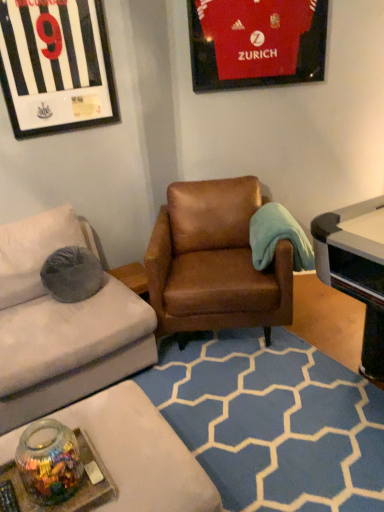
What do you see at coordinates (8, 497) in the screenshot? I see `black plastic remote control at lower left` at bounding box center [8, 497].

This screenshot has height=512, width=384. Describe the element at coordinates (67, 499) in the screenshot. I see `transparent glass jar at lower left` at that location.

Image resolution: width=384 pixels, height=512 pixels. I want to click on matte red jersey at upper right, the second picture frame from the left, so click(x=256, y=42).

What is the approximate height of brown leather armchair at center?

It is 85.01 centimeters.

The height and width of the screenshot is (512, 384). Identify the location of black glossy jersey at upper left, which is the second picture frame in right-to-left order. [56, 66].

Find the location of a particular element. This screenshot has width=384, height=512. black plastic remote control at lower left is located at coordinates (8, 497).

Is matte red jersey at upper right, arranged as the 1th picture frame when viewed from the right, looking in the opposite direction of brown leather armchair at center?

No, matte red jersey at upper right, arranged as the 1th picture frame when viewed from the right, is not facing the opposite direction of brown leather armchair at center.

How many degrees apart are the facing directions of matte red jersey at upper right, arranged as the 1th picture frame when viewed from the right, and brown leather armchair at center?

The facing directions of matte red jersey at upper right, arranged as the 1th picture frame when viewed from the right, and brown leather armchair at center are 0.000905 degrees apart.

Consider the image. Is the surface of matte red jersey at upper right, arranged as the 1th picture frame when viewed from the right, in direct contact with brown leather armchair at center?

matte red jersey at upper right, arranged as the 1th picture frame when viewed from the right, and brown leather armchair at center are clearly separated.

Which is more to the left, matte red jersey at upper right, the second picture frame from the left, or brown leather armchair at center?

From the viewer's perspective, brown leather armchair at center appears more on the left side.

How different are the orientations of black plastic remote control at lower left and matte red jersey at upper right, the second picture frame from the left, in degrees?

32.7 degrees separate the facing orientations of black plastic remote control at lower left and matte red jersey at upper right, the second picture frame from the left.

Looking at the image, does black plastic remote control at lower left seem bigger or smaller compared to matte red jersey at upper right, the second picture frame from the left?

In the image, black plastic remote control at lower left appears to be smaller than matte red jersey at upper right, the second picture frame from the left.

In the image, there is a matte red jersey at upper right, the second picture frame from the left. Identify the location of remote control below it (from the image's perspective). (8, 497).

Is black plastic remote control at lower left outside of matte red jersey at upper right, the second picture frame from the left?

Yes, black plastic remote control at lower left is not within matte red jersey at upper right, the second picture frame from the left.

Considering the sizes of objects black plastic remote control at lower left and transparent glass jar at lower left in the image provided, who is taller, black plastic remote control at lower left or transparent glass jar at lower left?

transparent glass jar at lower left.

This screenshot has height=512, width=384. Find the location of `round table that is on the right side of black plastic remote control at lower left`. round table that is on the right side of black plastic remote control at lower left is located at coordinates (67, 499).

Consider the image. From a real-world perspective, does black plastic remote control at lower left sit lower than transparent glass jar at lower left?

Yes, from a real-world perspective, black plastic remote control at lower left is beneath transparent glass jar at lower left.

From the picture: From a real-world perspective, which is physically below, black glossy jersey at upper left, which is the second picture frame in right-to-left order, or black plastic remote control at lower left?

black plastic remote control at lower left, from a real-world perspective.

Consider the image. Is the depth of black glossy jersey at upper left, which is the second picture frame in right-to-left order, less than that of black plastic remote control at lower left?

No, the depth of black glossy jersey at upper left, which is the second picture frame in right-to-left order, is greater than that of black plastic remote control at lower left.

Looking at this image, can you confirm if black glossy jersey at upper left, which is the second picture frame in right-to-left order, is thinner than black plastic remote control at lower left?

Yes, black glossy jersey at upper left, which is the second picture frame in right-to-left order, is thinner than black plastic remote control at lower left.

Does black glossy jersey at upper left, which is the second picture frame in right-to-left order, have a lesser height compared to black plastic remote control at lower left?

In fact, black glossy jersey at upper left, which is the second picture frame in right-to-left order, may be taller than black plastic remote control at lower left.

How distant is matte red jersey at upper right, arranged as the 1th picture frame when viewed from the right, from transparent glass jar at lower left?

matte red jersey at upper right, arranged as the 1th picture frame when viewed from the right, and transparent glass jar at lower left are 2.32 meters apart from each other.

In the scene shown: Is matte red jersey at upper right, arranged as the 1th picture frame when viewed from the right, turned away from transparent glass jar at lower left?

No, matte red jersey at upper right, arranged as the 1th picture frame when viewed from the right, is not facing the opposite direction of transparent glass jar at lower left.

Based on the photo, from the image's perspective, who appears lower, matte red jersey at upper right, the second picture frame from the left, or transparent glass jar at lower left?

transparent glass jar at lower left.

From a real-world perspective, is brown leather armchair at center above or below black plastic remote control at lower left?

brown leather armchair at center is situated higher than black plastic remote control at lower left in the real world.

Is brown leather armchair at center oriented away from black plastic remote control at lower left?

brown leather armchair at center does not have its back to black plastic remote control at lower left.

Is brown leather armchair at center not within black plastic remote control at lower left?

Absolutely, brown leather armchair at center is external to black plastic remote control at lower left.

From the image's perspective, is brown leather armchair at center located above black plastic remote control at lower left?

Yes, from the image's perspective, brown leather armchair at center is over black plastic remote control at lower left.

Is matte red jersey at upper right, arranged as the 1th picture frame when viewed from the right, positioned in front of black plastic remote control at lower left?

No, the depth of matte red jersey at upper right, arranged as the 1th picture frame when viewed from the right, is greater than that of black plastic remote control at lower left.

Is point (211, 58) in front of point (10, 502)?

No, (211, 58) is behind (10, 502).

Consider the image. From a real-world perspective, which object rests below the other?

In real-world perspective, black plastic remote control at lower left is lower.

Is matte red jersey at upper right, the second picture frame from the left, placed right next to black plastic remote control at lower left?

No, matte red jersey at upper right, the second picture frame from the left, is not in contact with black plastic remote control at lower left.

Identify the location of chair below the matte red jersey at upper right, arranged as the 1th picture frame when viewed from the right (from the image's perspective). (214, 262).

The image size is (384, 512). I want to click on remote control located underneath the matte red jersey at upper right, arranged as the 1th picture frame when viewed from the right (from a real-world perspective), so click(x=8, y=497).

Based on their spatial positions, is matte red jersey at upper right, the second picture frame from the left, or transparent glass jar at lower left closer to black plastic remote control at lower left?

Based on the image, transparent glass jar at lower left appears to be nearer to black plastic remote control at lower left.

Based on their spatial positions, is black glossy jersey at upper left, which ranks as the first picture frame in left-to-right order, or transparent glass jar at lower left closer to brown leather armchair at center?

black glossy jersey at upper left, which ranks as the first picture frame in left-to-right order.

Which object lies further to the anchor point black glossy jersey at upper left, which ranks as the first picture frame in left-to-right order, transparent glass jar at lower left or black plastic remote control at lower left?

black plastic remote control at lower left is further to black glossy jersey at upper left, which ranks as the first picture frame in left-to-right order.

When comparing their distances from matte red jersey at upper right, the second picture frame from the left, does black glossy jersey at upper left, which ranks as the first picture frame in left-to-right order, or transparent glass jar at lower left seem closer?

black glossy jersey at upper left, which ranks as the first picture frame in left-to-right order, is positioned closer to the anchor matte red jersey at upper right, the second picture frame from the left.

Looking at the image, which one is located further to black plastic remote control at lower left, transparent glass jar at lower left or matte red jersey at upper right, the second picture frame from the left?

Among the two, matte red jersey at upper right, the second picture frame from the left, is located further to black plastic remote control at lower left.

Based on their spatial positions, is black plastic remote control at lower left or matte red jersey at upper right, the second picture frame from the left, closer to transparent glass jar at lower left?

The object closer to transparent glass jar at lower left is black plastic remote control at lower left.

Looking at the image, which one is located closer to transparent glass jar at lower left, brown leather armchair at center or black glossy jersey at upper left, which is the second picture frame in right-to-left order?

brown leather armchair at center lies closer to transparent glass jar at lower left than the other object.

Considering their positions, is brown leather armchair at center positioned closer to black plastic remote control at lower left than matte red jersey at upper right, the second picture frame from the left?

Among the two, brown leather armchair at center is located nearer to black plastic remote control at lower left.

This screenshot has width=384, height=512. In order to click on chair between black glossy jersey at upper left, which ranks as the first picture frame in left-to-right order, and transparent glass jar at lower left from top to bottom in this screenshot , I will do `click(214, 262)`.

Identify the location of picture frame that lies between matte red jersey at upper right, arranged as the 1th picture frame when viewed from the right, and black plastic remote control at lower left from top to bottom. (56, 66).

Where is `round table between matte red jersey at upper right, the second picture frame from the left, and black plastic remote control at lower left vertically`? The height and width of the screenshot is (512, 384). round table between matte red jersey at upper right, the second picture frame from the left, and black plastic remote control at lower left vertically is located at coordinates (67, 499).

Locate an element on the screen. The width and height of the screenshot is (384, 512). chair that lies between matte red jersey at upper right, arranged as the 1th picture frame when viewed from the right, and black plastic remote control at lower left from top to bottom is located at coordinates (214, 262).